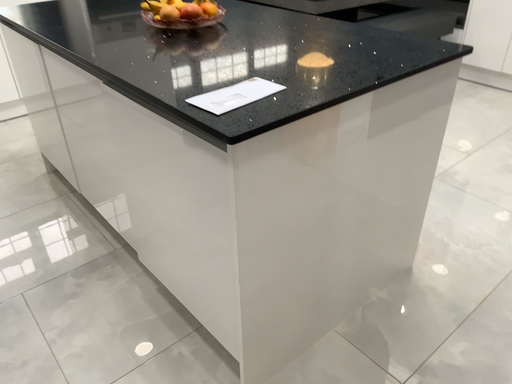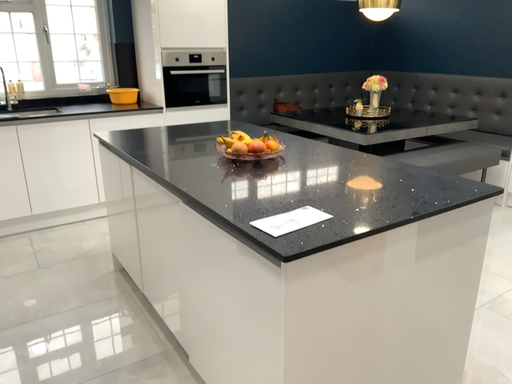
Question: How did the camera likely rotate when shooting the video?

Choices:
 (A) rotated upward
 (B) rotated downward

Answer: (A)